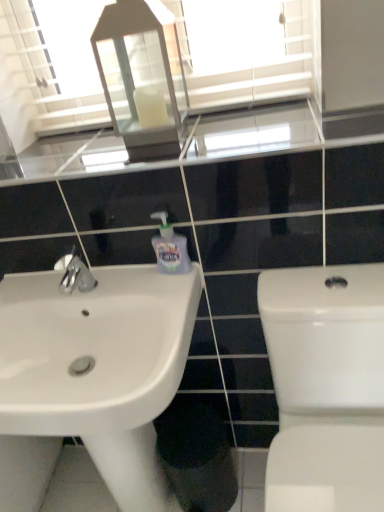
Identify the location of free space to the right of white glass lantern at upper center. (220, 124).